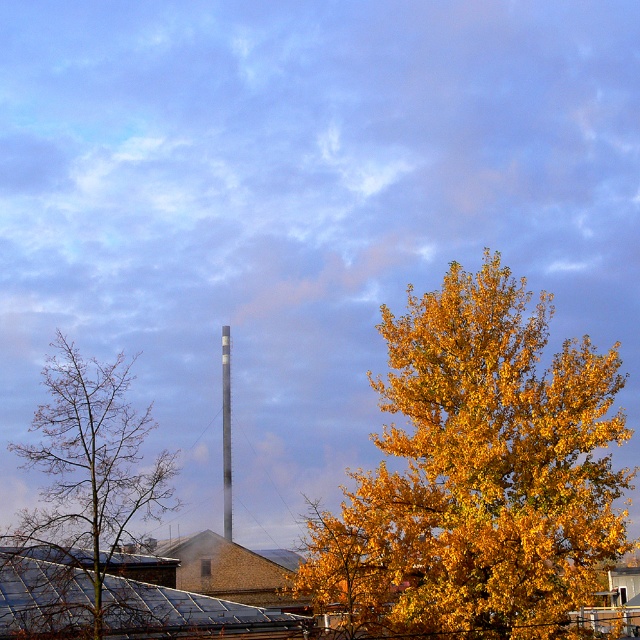
Question: Which of these objects is positioned farthest from the golden yellow leaves at center?

Choices:
 (A) bare branches at left
 (B) smooth gray chimney at center

Answer: (B)

Question: Can you confirm if bare branches at left is bigger than smooth gray chimney at center?

Choices:
 (A) yes
 (B) no

Answer: (A)

Question: Estimate the real-world distances between objects in this image. Which object is farther from the smooth gray chimney at center?

Choices:
 (A) golden yellow leaves at center
 (B) bare branches at left

Answer: (A)

Question: Can you confirm if bare branches at left is thinner than smooth gray chimney at center?

Choices:
 (A) no
 (B) yes

Answer: (A)

Question: Can you confirm if golden yellow leaves at center is wider than smooth gray chimney at center?

Choices:
 (A) yes
 (B) no

Answer: (A)

Question: Which point is closer to the camera taking this photo?

Choices:
 (A) (49, 429)
 (B) (230, 500)
 (C) (568, 554)

Answer: (A)